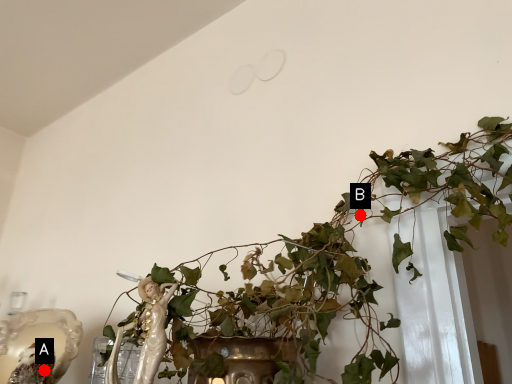
Question: Two points are circled on the image, labeled by A and B beside each circle. Which point is closer to the camera?

Choices:
 (A) A is closer
 (B) B is closer

Answer: (B)